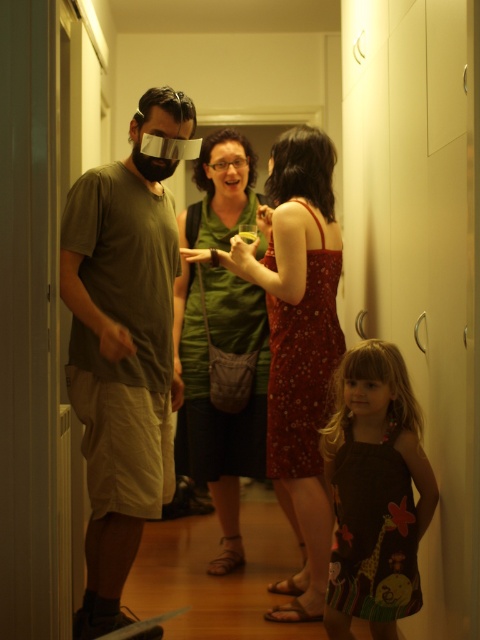
Question: Does matte green dress at center appear over dark brown fabric dress at lower right?

Choices:
 (A) no
 (B) yes

Answer: (B)

Question: Which point is farther to the camera?

Choices:
 (A) matte green dress at center
 (B) green fabric dress at center

Answer: (B)

Question: Which point appears farthest from the camera in this image?

Choices:
 (A) (92, 557)
 (B) (321, 472)
 (C) (241, 138)
 (D) (116, 435)

Answer: (C)

Question: Can you confirm if matte green dress at center is wider than green fabric dress at center?

Choices:
 (A) no
 (B) yes

Answer: (A)

Question: Which is farther from the floral fabric dress at center?

Choices:
 (A) matte green dress at center
 (B) matte green t-shirt at left
 (C) green fabric dress at center
 (D) dark brown fabric dress at lower right

Answer: (A)

Question: Can you confirm if matte green dress at center is positioned to the left of green fabric dress at center?

Choices:
 (A) no
 (B) yes

Answer: (B)